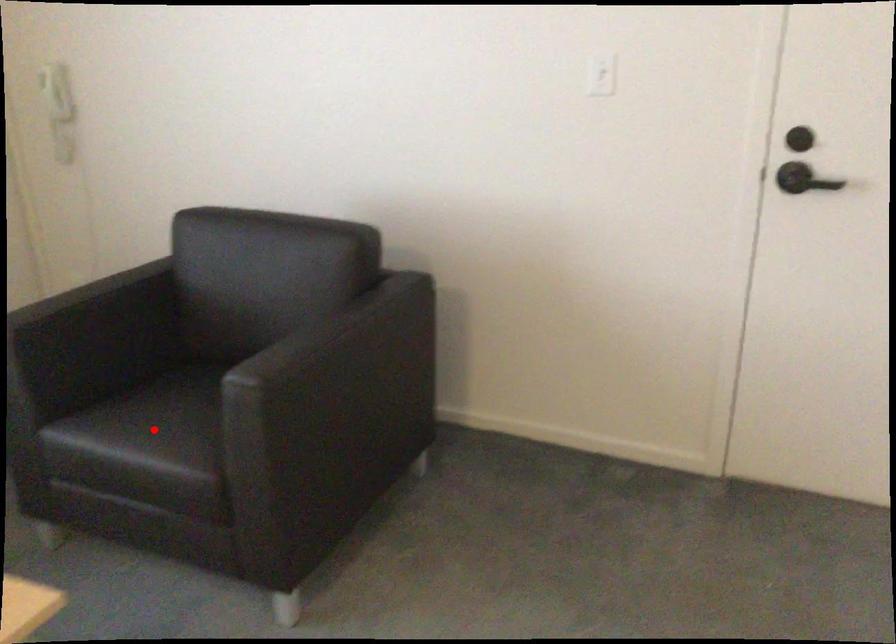
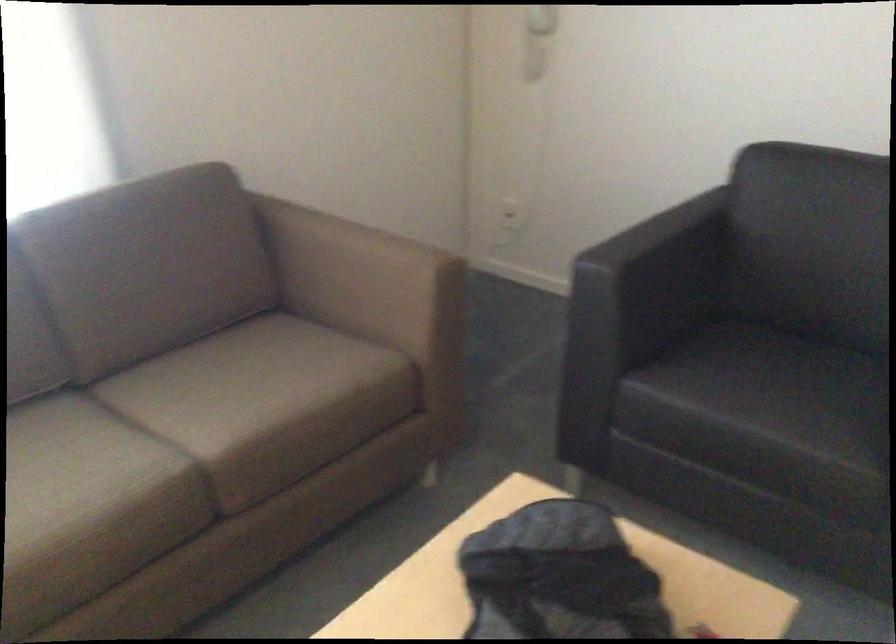
Question: A red point is marked in image1. In image2, is the corresponding 3D point closer to the camera or farther? Reply with the corresponding letter.

Choices:
 (A) The corresponding 3D point is closer.
 (B) The corresponding 3D point is farther.

Answer: (A)